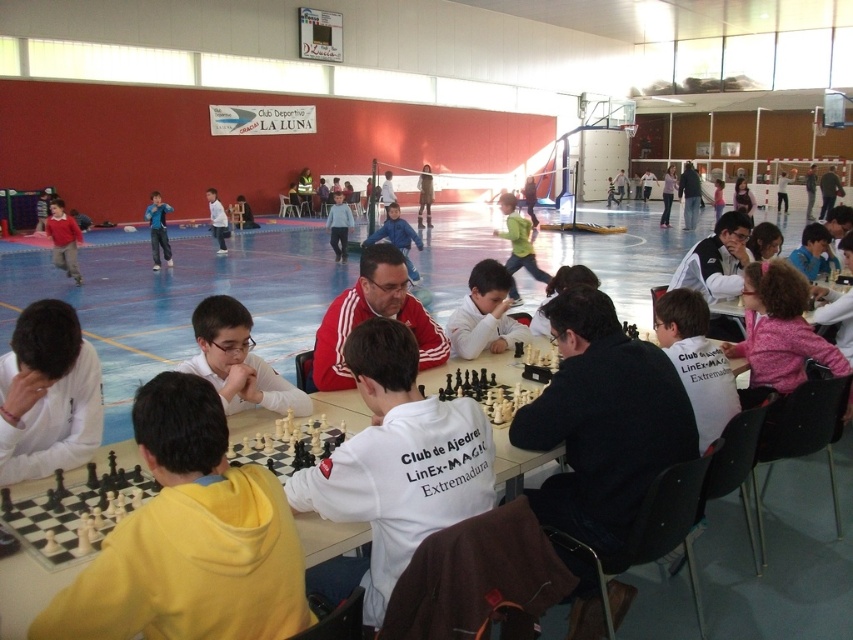
What is the color of the object located at point (189,540) in the image?

The object at point (189,540) is yellow fleece.

You are a photographer at the chess tournament. You want to take a photo of the yellow fleece at center and blue denim jeans at center in the same frame. Given that your camera has a maximum focus range of 12 meters, will both subjects be in focus?

The distance between the yellow fleece at center and blue denim jeans at center is 12.10 meters, which exceeds the camera maximum focus range of 12 meters. Therefore, both subjects cannot be in focus simultaneously.